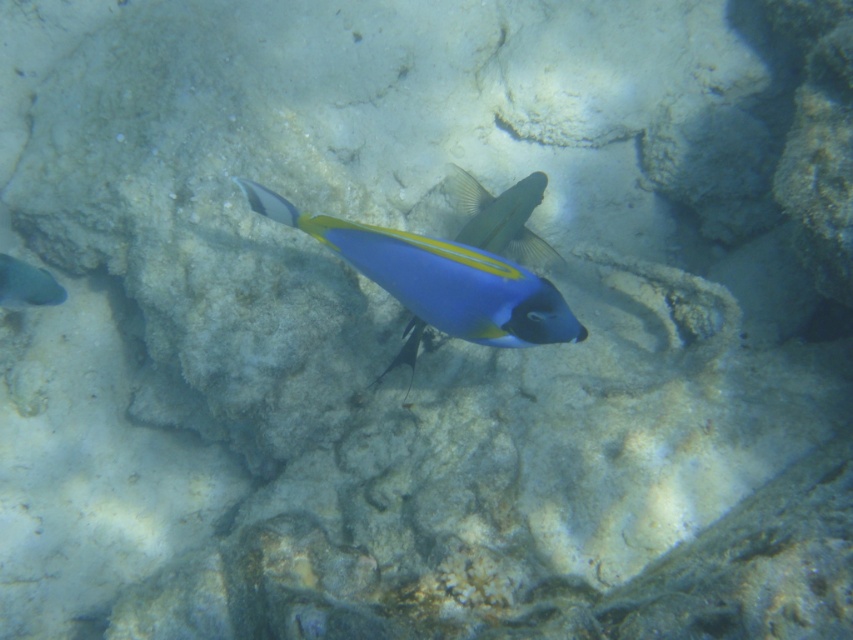
Who is more distant from viewer, (537,196) or (9,280)?

The point (537,196) is more distant.

Is blue glossy fish at center in front of matte gray fish at left?

That is False.

Where is `blue glossy fish at center`? The image size is (853, 640). blue glossy fish at center is located at coordinates (498, 216).

The width and height of the screenshot is (853, 640). I want to click on blue glossy fish at center, so click(498, 216).

Is shiny blue fish at center thinner than blue glossy fish at center?

No, shiny blue fish at center is not thinner than blue glossy fish at center.

I want to click on shiny blue fish at center, so click(437, 282).

What are the coordinates of `shiny blue fish at center` in the screenshot? It's located at (437, 282).

Is shiny blue fish at center below matte gray fish at left?

No.

Is shiny blue fish at center wider than matte gray fish at left?

Correct, the width of shiny blue fish at center exceeds that of matte gray fish at left.

Does point (318, 225) lie behind point (10, 289)?

No, it is not.

Where is `shiny blue fish at center`? Image resolution: width=853 pixels, height=640 pixels. shiny blue fish at center is located at coordinates (437, 282).